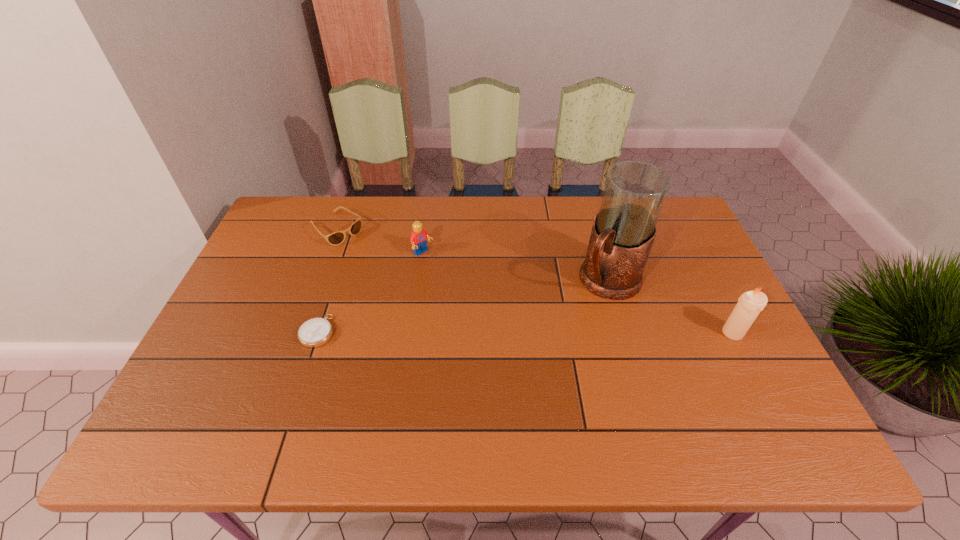
Find the location of a particular element. vacant region between the third object from right to left and the fourth tallest object is located at coordinates (379, 241).

At what (x,y) coordinates should I click in order to perform the action: click on free space between the candle and the Lego. Please return your answer as a coordinate pair (x, y). The width and height of the screenshot is (960, 540). Looking at the image, I should click on (578, 293).

Image resolution: width=960 pixels, height=540 pixels. I want to click on free area in between the fourth object from left to right and the second tallest object, so click(671, 307).

You are a GUI agent. You are given a task and a screenshot of the screen. Output one action in this format:
    pyautogui.click(x=<x>, y=<y>)
    Task: Click on the vacant area that lies between the tallest object and the compass
    This screenshot has width=960, height=540.
    Given the screenshot: What is the action you would take?
    pyautogui.click(x=463, y=306)

Image resolution: width=960 pixels, height=540 pixels. Find the location of `vacant area between the shortest object and the second tallest object`. vacant area between the shortest object and the second tallest object is located at coordinates (525, 332).

I want to click on vacant area that lies between the third tallest object and the compass, so click(371, 292).

Where is `unoccupied position between the sunglasses and the pitcher`? unoccupied position between the sunglasses and the pitcher is located at coordinates (472, 256).

I want to click on empty space that is in between the rightmost object and the tallest object, so click(x=671, y=307).

The width and height of the screenshot is (960, 540). Identify the location of vacant area between the fourth tallest object and the compass. (327, 280).

Find the location of a particular element. The image size is (960, 540). object that is the fourth closest to the tallest object is located at coordinates (336, 238).